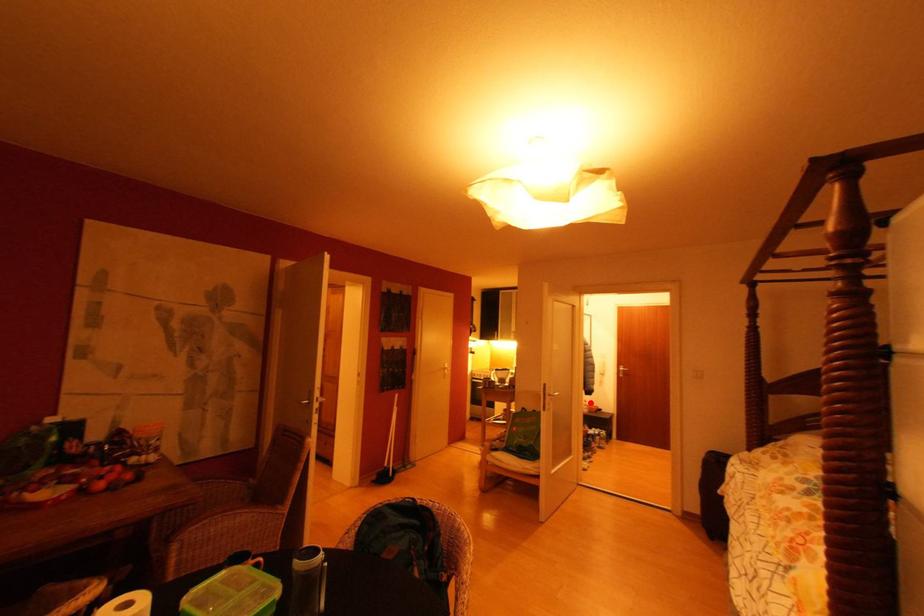
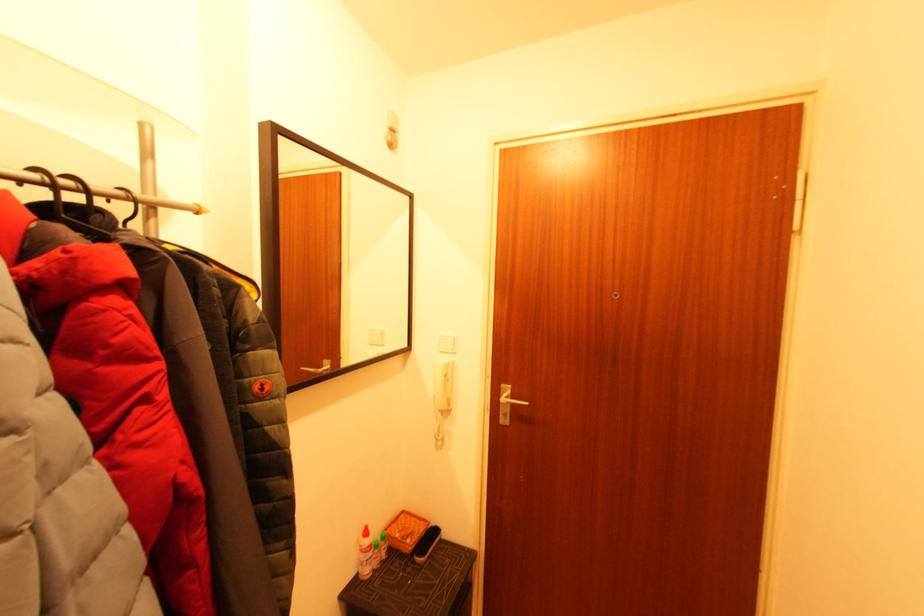
In the second image, find the point that corresponds to the highlighted location in the first image.

(371, 535)